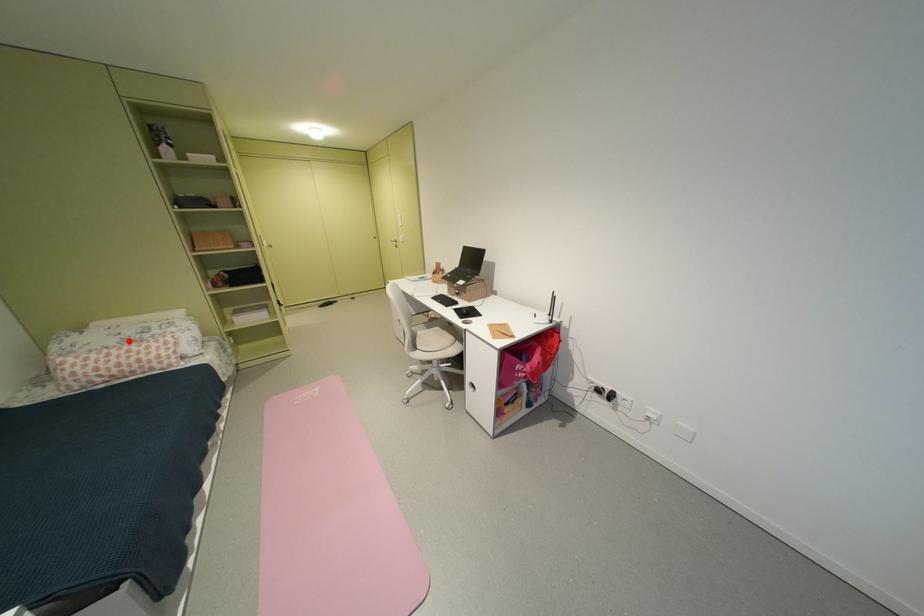
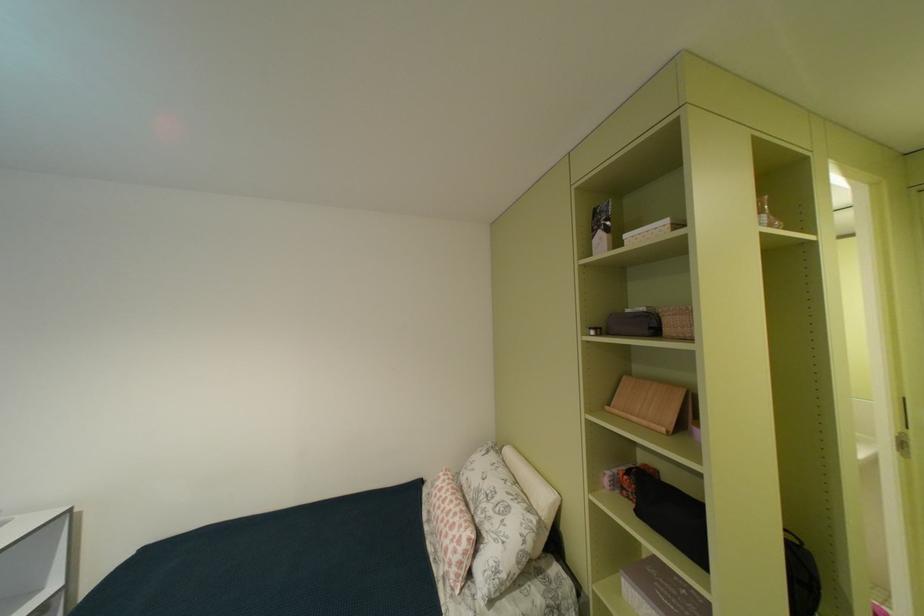
The point at the highlighted location is marked in the first image. Where is the corresponding point in the second image?

(487, 487)